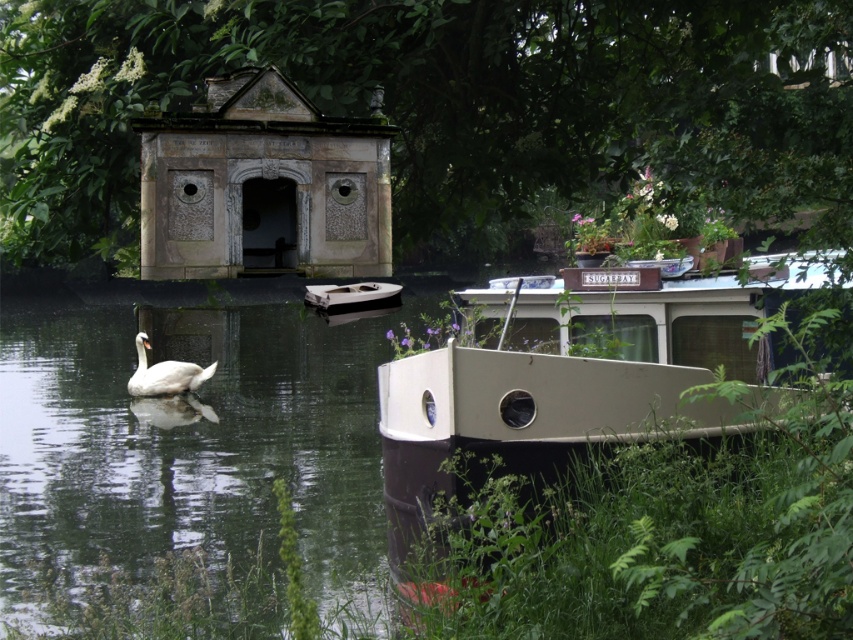
You are standing at the origin point of the riverside scene. The smooth brown boat at lower right is located at coordinates 0.684 on the x axis and 0.227 on the y axis. If you want to reach the boat, which direction should you move in? Please provide your answer in terms of compass directions and distance in meters. Assume the coordinate system has the origin at the bottom left corner of the image, with the x axis increasing to the right and the y axis increasing upwards. Each unit in the coordinate system

The smooth brown boat at lower right is located at coordinates 0.684 on the x axis and 0.227 on the y axis. To reach it from the origin, you would need to move eastward along the x axis to 0.684 and slightly northward along the y axis to 0.227. The distance can be calculated using the Pythagorean theorem, but since the coordinate system units aren